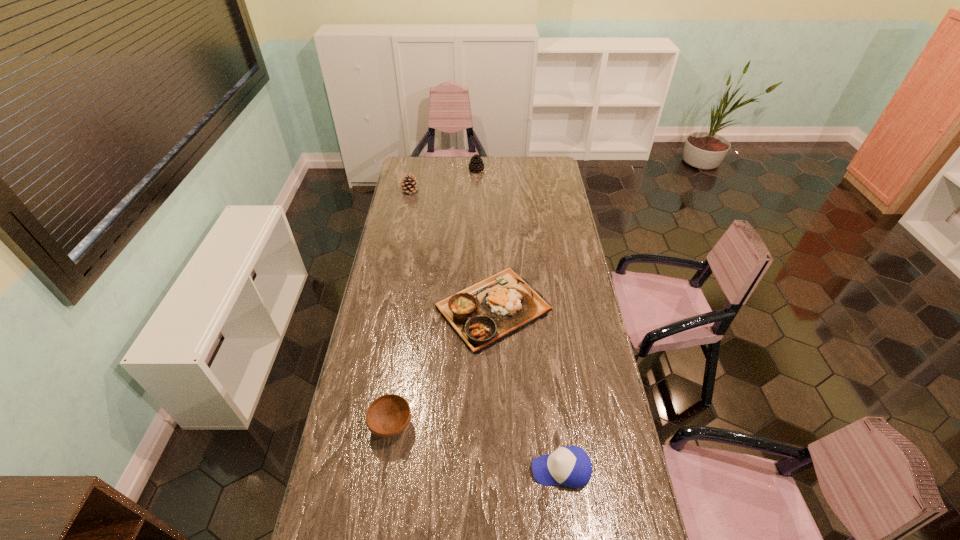
At what (x,y) coordinates should I click in order to perform the action: click on the closest object to the left pinecone. Please return your answer as a coordinate pair (x, y). The width and height of the screenshot is (960, 540). Looking at the image, I should click on (476, 164).

Select which object appears as the closest to the platter. Please provide its 2D coordinates. Your answer should be formatted as a tuple, i.e. [(x, y)], where the tuple contains the x and y coordinates of a point satisfying the conditions above.

[(387, 416)]

Where is `vacant space that satisfies the following two spatial constraints: 1. at the narrow end of the farthest object; 2. on the left side of the third farthest object`? vacant space that satisfies the following two spatial constraints: 1. at the narrow end of the farthest object; 2. on the left side of the third farthest object is located at coordinates (475, 309).

You are a GUI agent. You are given a task and a screenshot of the screen. Output one action in this format:
    pyautogui.click(x=<x>, y=<y>)
    Task: Click on the vacant region that satisfies the following two spatial constraints: 1. at the narrow end of the farther pinecone; 2. on the back side of the platter
    The image size is (960, 540).
    Given the screenshot: What is the action you would take?
    pyautogui.click(x=475, y=309)

At what (x,y) coordinates should I click in order to perform the action: click on free space that satisfies the following two spatial constraints: 1. on the back side of the platter; 2. at the narrow end of the farthest object. Please return your answer as a coordinate pair (x, y). The image size is (960, 540). Looking at the image, I should click on (489, 170).